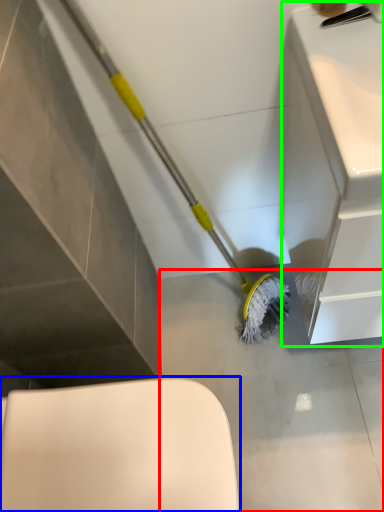
Question: Which is nearer to the concrete (highlighted by a red box)? toilet (highlighted by a blue box) or counter top (highlighted by a green box).

Choices:
 (A) toilet
 (B) counter top

Answer: (B)